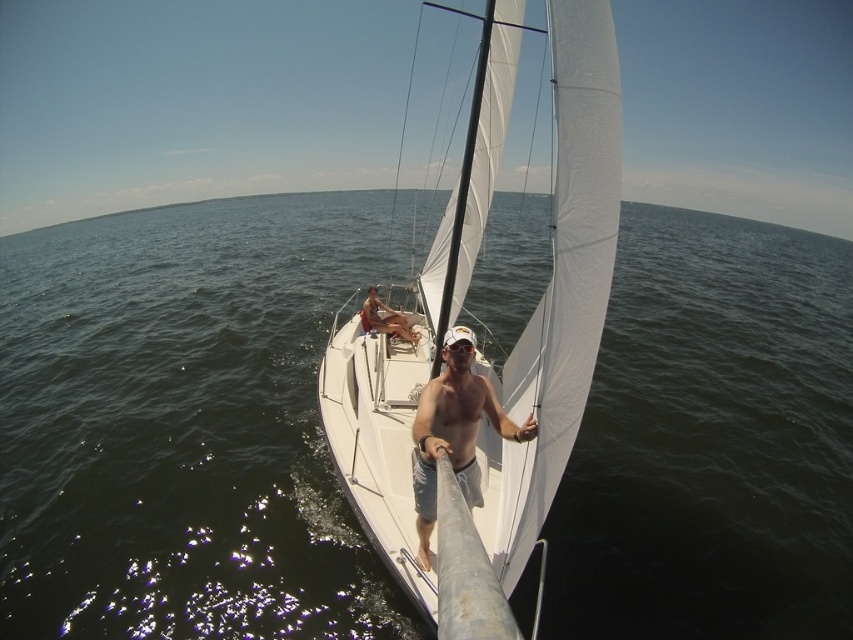
You are navigating a sailboat and need to adjust the sail. You have two points marked on the sail for reference. The first point is at coordinates point (138, 493) and the second point is at point (402, 333). Which point is closer to the front of the boat?

Point (138, 493) is in front of point (402, 333), so it is closer to the front of the boat.